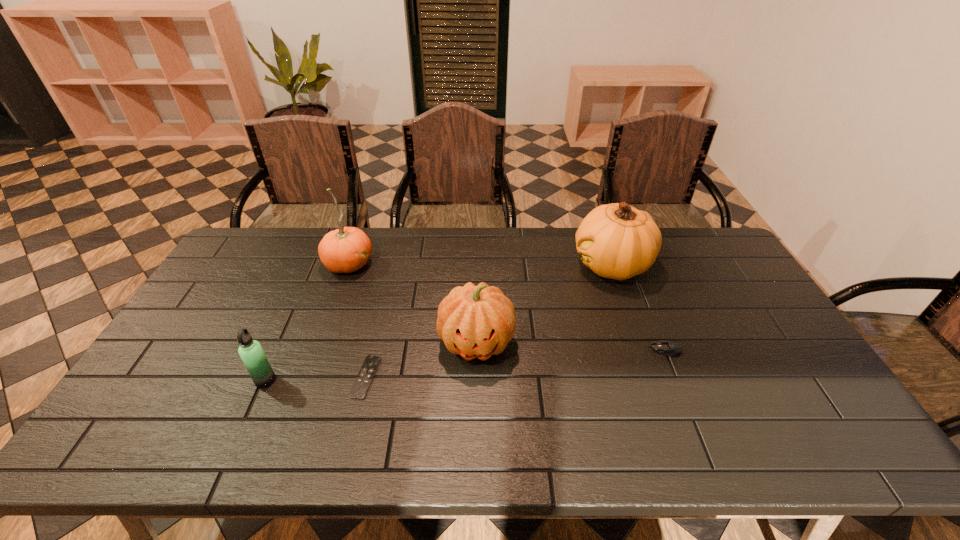
Find the location of a particular element. vacant space located on the front face of the rightmost pumpkin is located at coordinates (528, 265).

Image resolution: width=960 pixels, height=540 pixels. Identify the location of vacant area situated on the left of the leftmost pumpkin. (259, 264).

The width and height of the screenshot is (960, 540). In order to click on free space located on the carved face of the third object from right to left in this screenshot , I will do `click(475, 448)`.

What are the coordinates of `free region located on the left of the thermos bottle` in the screenshot? It's located at (175, 380).

At what (x,y) coordinates should I click in order to perform the action: click on blank space located on the left of the computer mouse. Please return your answer as a coordinate pair (x, y). The height and width of the screenshot is (540, 960). Looking at the image, I should click on (620, 350).

Image resolution: width=960 pixels, height=540 pixels. Identify the location of free space located on the right of the shortest object. (435, 377).

The height and width of the screenshot is (540, 960). What are the coordinates of `vacant space at the far edge` in the screenshot? It's located at (450, 245).

Find the location of a particular element. The width and height of the screenshot is (960, 540). free space at the near edge is located at coordinates (730, 439).

The image size is (960, 540). In the image, there is a desktop. In order to click on vacant space at the left edge in this screenshot , I will do `click(171, 422)`.

The height and width of the screenshot is (540, 960). I want to click on free space at the far left corner of the desktop, so click(x=283, y=227).